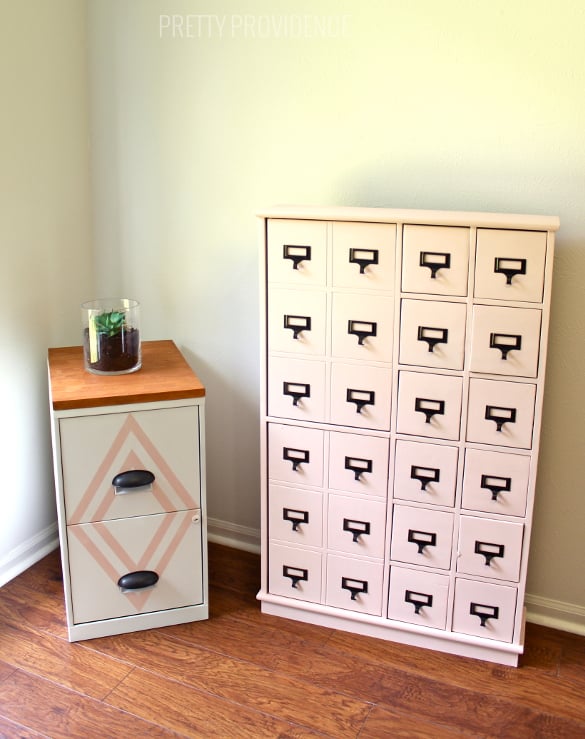
Find the location of `cabinet`. cabinet is located at coordinates (178, 508), (304, 486).